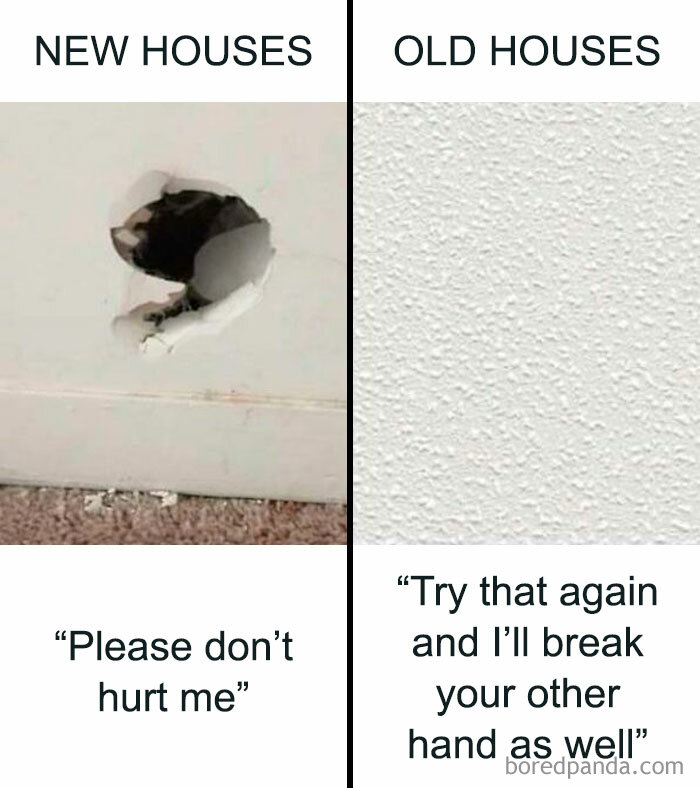
Where is `wall`? Image resolution: width=700 pixels, height=788 pixels. wall is located at coordinates (322, 337), (407, 429).